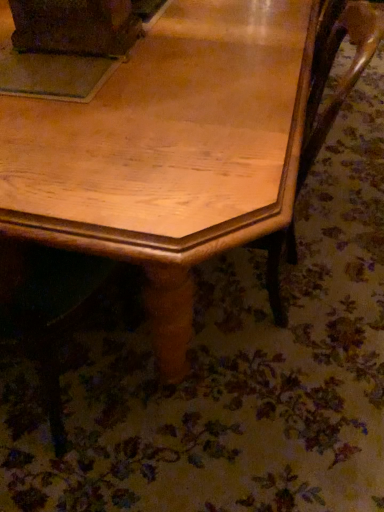
What do you see at coordinates (331, 67) in the screenshot? I see `wooden swivel chair at lower right` at bounding box center [331, 67].

This screenshot has width=384, height=512. In order to click on wooden swivel chair at lower right in this screenshot , I will do `click(331, 67)`.

Find the location of `wooden swivel chair at lower right`. wooden swivel chair at lower right is located at coordinates (331, 67).